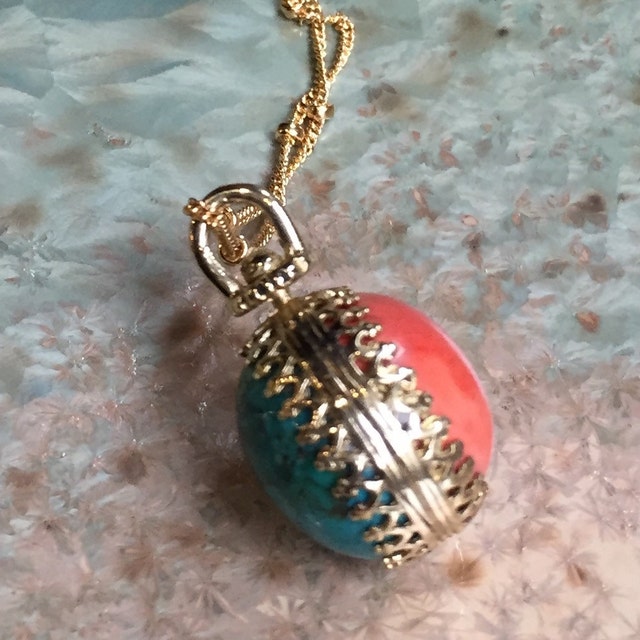
The height and width of the screenshot is (640, 640). Identify the location of pendant. (331, 384).